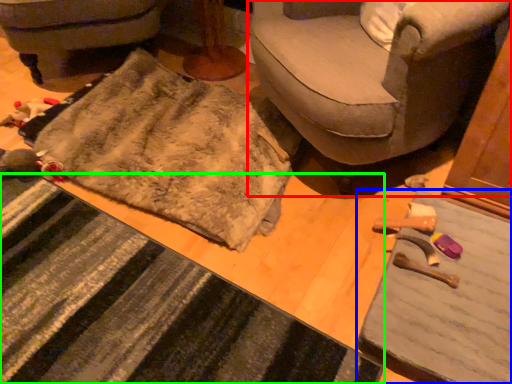
Question: Which is nearer to the studio couch (highlighted by a red box)? table (highlighted by a blue box) or doormat (highlighted by a green box).

Choices:
 (A) table
 (B) doormat

Answer: (A)